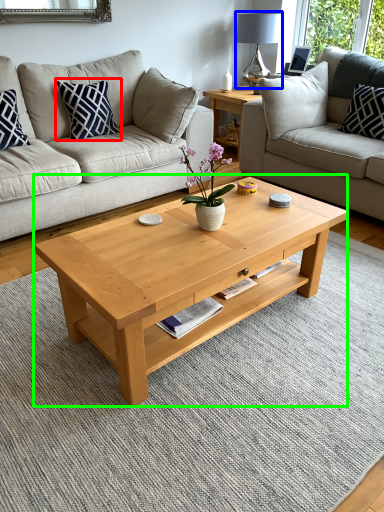
Question: Estimate the real-world distances between objects in this image. Which object is farther from pillow (highlighted by a red box), lamp (highlighted by a blue box) or coffee table (highlighted by a green box)?

Choices:
 (A) lamp
 (B) coffee table

Answer: (A)